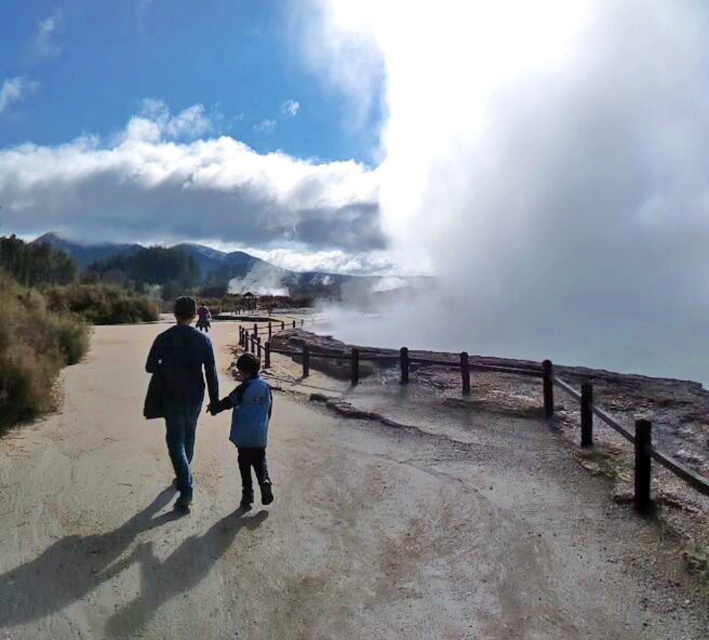
You are a drone operator trying to capture a photo of the white fluffy cloud at upper center. The drone has a camera with a 100mm lens. The cloud is at point (195, 193). The drone needs to position itself at a point that is 0.1 units to the left and 0.05 units above the cloud to get the perfect shot. What are the coordinates where the drone should position itself?

The drone should position itself at coordinates calculated by subtracting 0.1 from the x and adding 0.05 to the y of the white fluffy cloud at upper center. The cloud is at point (195, 193), so the drone should go to 0.203, 0.326.

You are a photographer standing at the starting point of the pathway. You want to take a photo of the dark blue fabric jacket at center and the white fluffy cloud at upper center so that the jacket appears in front of the cloud. Is this possible based on their current positions?

The dark blue fabric jacket at center is behind the white fluffy cloud at upper center, so it is not possible to have the jacket appear in front of the cloud in the current arrangement.

You are a photographer standing at the camera position. You want to take a photo that includes both point (354, 419) and point (350, 228). Since you want to focus on the closer point, which point should you focus on?

Point (354, 419) is closer to the camera than point (350, 228), so you should focus on point (354, 419).